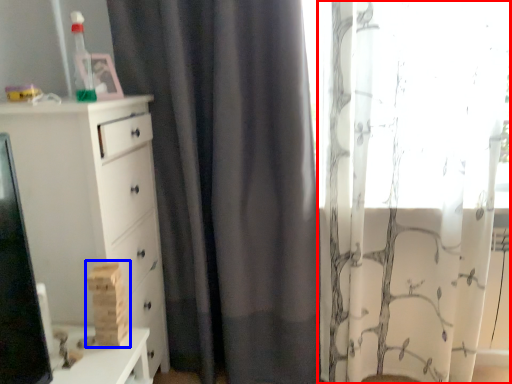
Question: Which object appears farthest to the camera in this image, curtain (highlighted by a red box) or toy (highlighted by a blue box)?

Choices:
 (A) curtain
 (B) toy

Answer: (A)